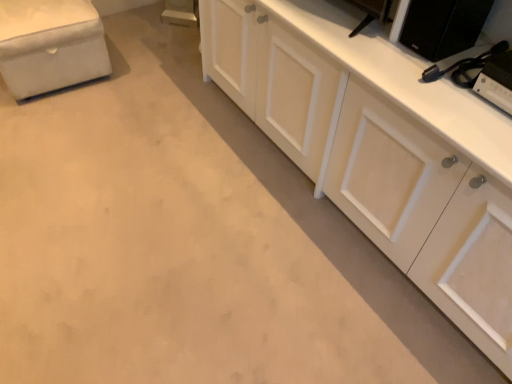
Question: In the image, is white wood cabinet at right positioned in front of or behind black matte speaker at upper right, the second appliance when ordered from bottom to top?

Choices:
 (A) front
 (B) behind

Answer: (A)

Question: Looking at the image, does white wood cabinet at right seem bigger or smaller compared to black matte speaker at upper right, acting as the first appliance starting from the top?

Choices:
 (A) big
 (B) small

Answer: (A)

Question: Which of these objects is positioned farthest from the white wood cabinet at right?

Choices:
 (A) black matte speaker at upper right, acting as the first appliance starting from the top
 (B) black plastic game console at upper right, arranged as the 1th appliance when ordered from the bottom
 (C) white fabric ottoman at upper left

Answer: (C)

Question: Estimate the real-world distances between objects in this image. Which object is farther from the black matte speaker at upper right, the second appliance when ordered from bottom to top?

Choices:
 (A) white wood cabinet at right
 (B) white fabric ottoman at upper left
 (C) black plastic game console at upper right, arranged as the 1th appliance when ordered from the bottom

Answer: (B)